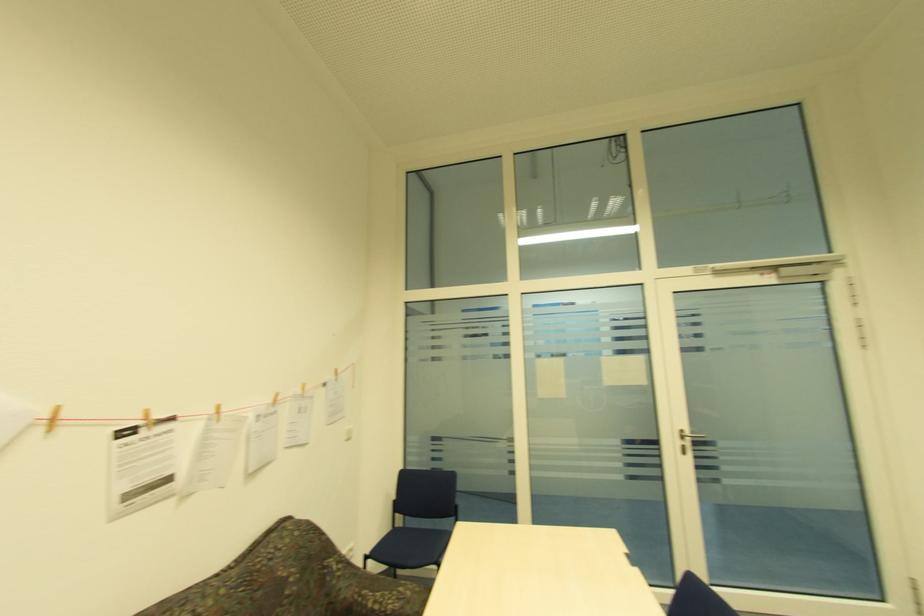
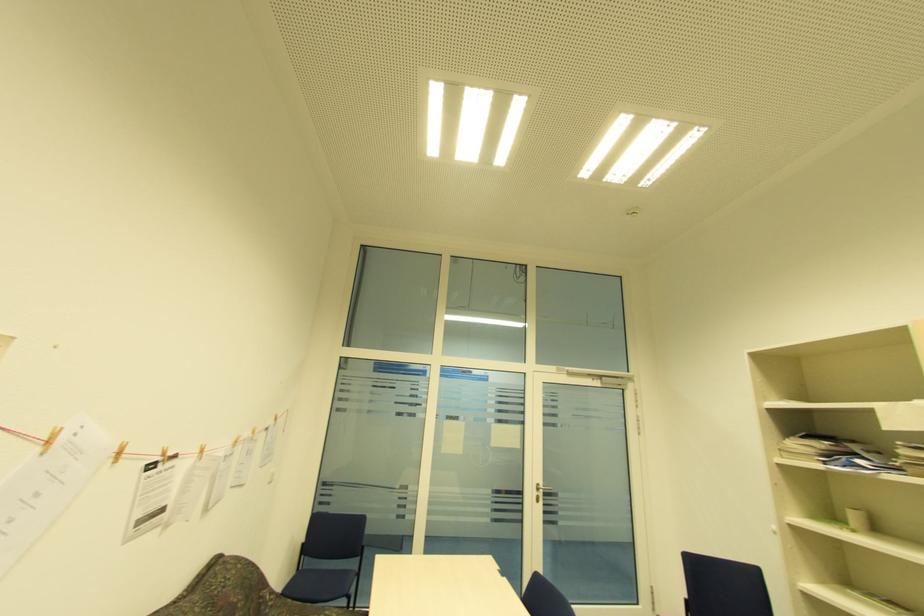
In the second image, find the point that corresponds to the point at 141,416 in the first image.

(163, 454)